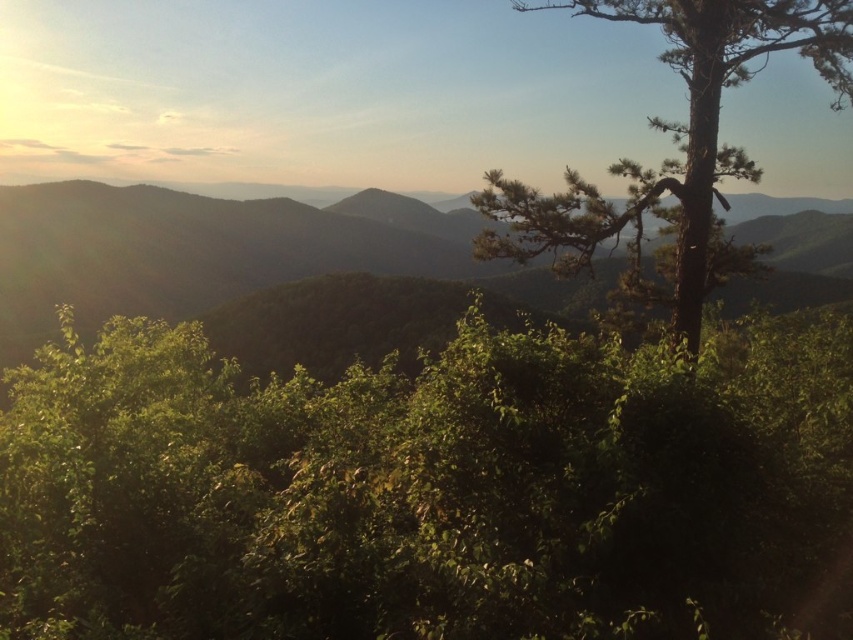
Does green leafy tree at center have a lesser height compared to green leafy vegetation at center?

Yes.

Looking at this image, between green leafy tree at center and green leafy vegetation at center, which one has less height?

green leafy tree at center

Which is behind, point (49, 484) or point (10, 323)?

The point (10, 323) is behind.

Identify the location of green leafy tree at center. (422, 488).

Can you confirm if green textured tree at right is positioned below green matte hill at center?

No.

Is green textured tree at right taller than green matte hill at center?

Correct, green textured tree at right is much taller as green matte hill at center.

Which is in front, point (618, 172) or point (351, 198)?

Positioned in front is point (618, 172).

In order to click on green textured tree at right in this screenshot , I will do `click(674, 141)`.

Is green leafy vegetation at center thinner than green matte hill at center?

No.

Does point (216, 252) come farther from viewer compared to point (395, 211)?

No, it is in front of (395, 211).

Locate an element on the screen. Image resolution: width=853 pixels, height=640 pixels. green leafy vegetation at center is located at coordinates (184, 253).